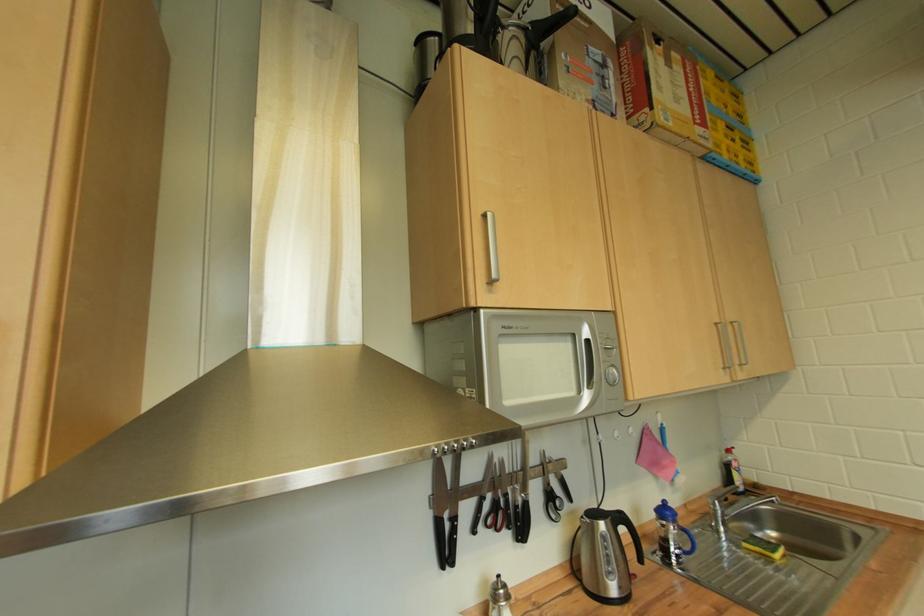
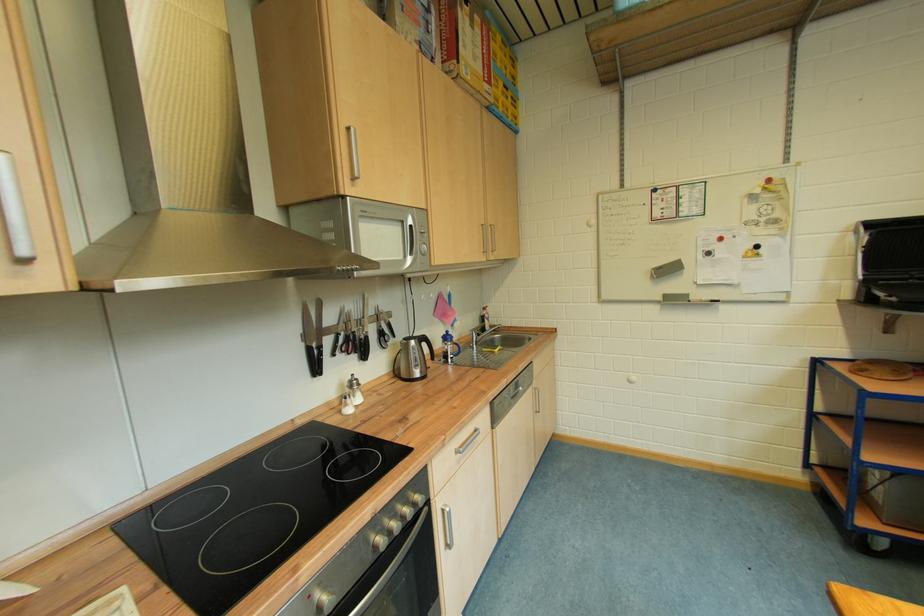
Locate, in the second image, the point that corresponds to point 596,342 in the first image.

(419, 229)